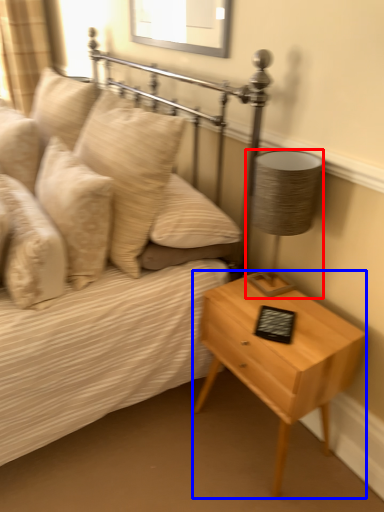
Question: Which of the following is the closest to the observer, lamp (highlighted by a red box) or nightstand (highlighted by a blue box)?

Choices:
 (A) lamp
 (B) nightstand

Answer: (B)